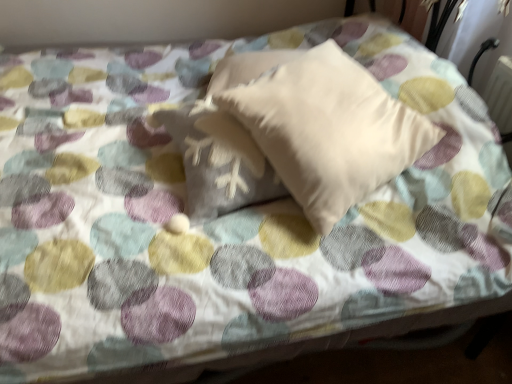
This screenshot has width=512, height=384. Describe the element at coordinates (223, 143) in the screenshot. I see `beige soft pillow at center, which is counted as the 1th pillow, starting from the left` at that location.

Locate an element on the screen. beige soft pillow at center, acting as the 2th pillow starting from the right is located at coordinates (223, 143).

This screenshot has height=384, width=512. Find the location of `beige soft pillow at center, which ranks as the 1th pillow in right-to-left order`. beige soft pillow at center, which ranks as the 1th pillow in right-to-left order is located at coordinates (328, 129).

What do you see at coordinates (328, 129) in the screenshot?
I see `beige soft pillow at center, which ranks as the 1th pillow in right-to-left order` at bounding box center [328, 129].

Locate an element on the screen. beige soft pillow at center, which is counted as the 1th pillow, starting from the left is located at coordinates 223,143.

Would you say beige soft pillow at center, which is counted as the 1th pillow, starting from the left, is to the left or to the right of beige soft pillow at center, which ranks as the 1th pillow in right-to-left order, in the picture?

beige soft pillow at center, which is counted as the 1th pillow, starting from the left, is to the left of beige soft pillow at center, which ranks as the 1th pillow in right-to-left order.

Is the depth of beige soft pillow at center, which is counted as the 1th pillow, starting from the left, less than that of beige soft pillow at center, which ranks as the 1th pillow in right-to-left order?

No, beige soft pillow at center, which is counted as the 1th pillow, starting from the left, is further to the viewer.

Does point (199, 127) come in front of point (396, 108)?

Yes, point (199, 127) is closer to viewer.

From the image's perspective, which one is positioned higher, beige soft pillow at center, acting as the 2th pillow starting from the right, or beige soft pillow at center, which ranks as the 1th pillow in right-to-left order?

beige soft pillow at center, which ranks as the 1th pillow in right-to-left order, from the image's perspective.

From a real-world perspective, is beige soft pillow at center, acting as the 2th pillow starting from the right, positioned above or below beige soft pillow at center, which ranks as the 1th pillow in right-to-left order?

beige soft pillow at center, acting as the 2th pillow starting from the right, is below beige soft pillow at center, which ranks as the 1th pillow in right-to-left order.

Between beige soft pillow at center, which is counted as the 1th pillow, starting from the left, and beige soft pillow at center, which ranks as the second pillow in left-to-right order, which one has larger width?

beige soft pillow at center, which ranks as the second pillow in left-to-right order.

Considering the relative sizes of beige soft pillow at center, acting as the 2th pillow starting from the right, and beige soft pillow at center, which ranks as the 1th pillow in right-to-left order, in the image provided, is beige soft pillow at center, acting as the 2th pillow starting from the right, shorter than beige soft pillow at center, which ranks as the 1th pillow in right-to-left order,?

Indeed, beige soft pillow at center, acting as the 2th pillow starting from the right, has a lesser height compared to beige soft pillow at center, which ranks as the 1th pillow in right-to-left order.

Considering the relative sizes of beige soft pillow at center, which is counted as the 1th pillow, starting from the left, and beige soft pillow at center, which ranks as the 1th pillow in right-to-left order, in the image provided, is beige soft pillow at center, which is counted as the 1th pillow, starting from the left, bigger than beige soft pillow at center, which ranks as the 1th pillow in right-to-left order,?

Actually, beige soft pillow at center, which is counted as the 1th pillow, starting from the left, might be smaller than beige soft pillow at center, which ranks as the 1th pillow in right-to-left order.

Is beige soft pillow at center, acting as the 2th pillow starting from the right, positioned beyond the bounds of beige soft pillow at center, which ranks as the 1th pillow in right-to-left order?

Actually, beige soft pillow at center, acting as the 2th pillow starting from the right, is at least partially inside beige soft pillow at center, which ranks as the 1th pillow in right-to-left order.

Is beige soft pillow at center, which is counted as the 1th pillow, starting from the left, not near beige soft pillow at center, which ranks as the second pillow in left-to-right order?

beige soft pillow at center, which is counted as the 1th pillow, starting from the left, is actually quite close to beige soft pillow at center, which ranks as the second pillow in left-to-right order.

In the scene shown: Is beige soft pillow at center, which is counted as the 1th pillow, starting from the left, oriented away from beige soft pillow at center, which ranks as the second pillow in left-to-right order?

Absolutely, beige soft pillow at center, which is counted as the 1th pillow, starting from the left, is directed away from beige soft pillow at center, which ranks as the second pillow in left-to-right order.

How many degrees apart are the facing directions of beige soft pillow at center, acting as the 2th pillow starting from the right, and beige soft pillow at center, which ranks as the second pillow in left-to-right order?

The angle between the facing direction of beige soft pillow at center, acting as the 2th pillow starting from the right, and the facing direction of beige soft pillow at center, which ranks as the second pillow in left-to-right order, is 25.7 degrees.

Could you measure the distance between beige soft pillow at center, acting as the 2th pillow starting from the right, and beige soft pillow at center, which ranks as the second pillow in left-to-right order?

beige soft pillow at center, acting as the 2th pillow starting from the right, is 5.61 inches from beige soft pillow at center, which ranks as the second pillow in left-to-right order.

Find the location of a particular element. The height and width of the screenshot is (384, 512). pillow above the beige soft pillow at center, which is counted as the 1th pillow, starting from the left (from a real-world perspective) is located at coordinates (328, 129).

Considering the relative positions of beige soft pillow at center, which ranks as the 1th pillow in right-to-left order, and beige soft pillow at center, acting as the 2th pillow starting from the right, in the image provided, is beige soft pillow at center, which ranks as the 1th pillow in right-to-left order, to the left of beige soft pillow at center, acting as the 2th pillow starting from the right, from the viewer's perspective?

No.

Which object is closer to the camera, beige soft pillow at center, which ranks as the second pillow in left-to-right order, or beige soft pillow at center, which is counted as the 1th pillow, starting from the left?

beige soft pillow at center, which ranks as the second pillow in left-to-right order, is closer to the camera.

Looking at this image, which is closer to the camera, [350,199] or [231,74]?

Point [350,199] is closer to the camera than point [231,74].

From the image's perspective, is beige soft pillow at center, which ranks as the 1th pillow in right-to-left order, on top of beige soft pillow at center, which is counted as the 1th pillow, starting from the left?

Yes.

Looking at this image, from a real-world perspective, between beige soft pillow at center, which ranks as the 1th pillow in right-to-left order, and beige soft pillow at center, acting as the 2th pillow starting from the right, who is vertically lower?

beige soft pillow at center, acting as the 2th pillow starting from the right, is physically lower.

Consider the image. In terms of width, does beige soft pillow at center, which ranks as the 1th pillow in right-to-left order, look wider or thinner when compared to beige soft pillow at center, which is counted as the 1th pillow, starting from the left?

In the image, beige soft pillow at center, which ranks as the 1th pillow in right-to-left order, appears to be wider than beige soft pillow at center, which is counted as the 1th pillow, starting from the left.

Considering the relative sizes of beige soft pillow at center, which ranks as the 1th pillow in right-to-left order, and beige soft pillow at center, acting as the 2th pillow starting from the right, in the image provided, is beige soft pillow at center, which ranks as the 1th pillow in right-to-left order, taller than beige soft pillow at center, acting as the 2th pillow starting from the right,?

Indeed, beige soft pillow at center, which ranks as the 1th pillow in right-to-left order, has a greater height compared to beige soft pillow at center, acting as the 2th pillow starting from the right.

Considering the relative sizes of beige soft pillow at center, which ranks as the 1th pillow in right-to-left order, and beige soft pillow at center, which is counted as the 1th pillow, starting from the left, in the image provided, is beige soft pillow at center, which ranks as the 1th pillow in right-to-left order, bigger than beige soft pillow at center, which is counted as the 1th pillow, starting from the left,?

Correct, beige soft pillow at center, which ranks as the 1th pillow in right-to-left order, is larger in size than beige soft pillow at center, which is counted as the 1th pillow, starting from the left.

Could beige soft pillow at center, which is counted as the 1th pillow, starting from the left, be considered to be inside beige soft pillow at center, which ranks as the second pillow in left-to-right order?

Yes, beige soft pillow at center, which ranks as the second pillow in left-to-right order, contains beige soft pillow at center, which is counted as the 1th pillow, starting from the left.

Are beige soft pillow at center, which ranks as the second pillow in left-to-right order, and beige soft pillow at center, acting as the 2th pillow starting from the right, located far from each other?

They are positioned close to each other.

Is beige soft pillow at center, which ranks as the second pillow in left-to-right order, positioned with its back to beige soft pillow at center, which is counted as the 1th pillow, starting from the left?

Yes, beige soft pillow at center, which ranks as the second pillow in left-to-right order, is positioned with its back facing beige soft pillow at center, which is counted as the 1th pillow, starting from the left.

What's the angular difference between beige soft pillow at center, which ranks as the 1th pillow in right-to-left order, and beige soft pillow at center, which is counted as the 1th pillow, starting from the left,'s facing directions?

beige soft pillow at center, which ranks as the 1th pillow in right-to-left order, and beige soft pillow at center, which is counted as the 1th pillow, starting from the left, are facing 25.7 degrees away from each other.

Where is `pillow located on the left of beige soft pillow at center, which ranks as the 1th pillow in right-to-left order`? pillow located on the left of beige soft pillow at center, which ranks as the 1th pillow in right-to-left order is located at coordinates (223, 143).

You are a GUI agent. You are given a task and a screenshot of the screen. Output one action in this format:
    pyautogui.click(x=<x>, y=<y>)
    Task: Click on the pillow on the right of beige soft pillow at center, acting as the 2th pillow starting from the right
    The width and height of the screenshot is (512, 384).
    Given the screenshot: What is the action you would take?
    pyautogui.click(x=328, y=129)

You are a GUI agent. You are given a task and a screenshot of the screen. Output one action in this format:
    pyautogui.click(x=<x>, y=<y>)
    Task: Click on the pillow positioned vertically above the beige soft pillow at center, acting as the 2th pillow starting from the right (from a real-world perspective)
    
    Given the screenshot: What is the action you would take?
    pyautogui.click(x=328, y=129)